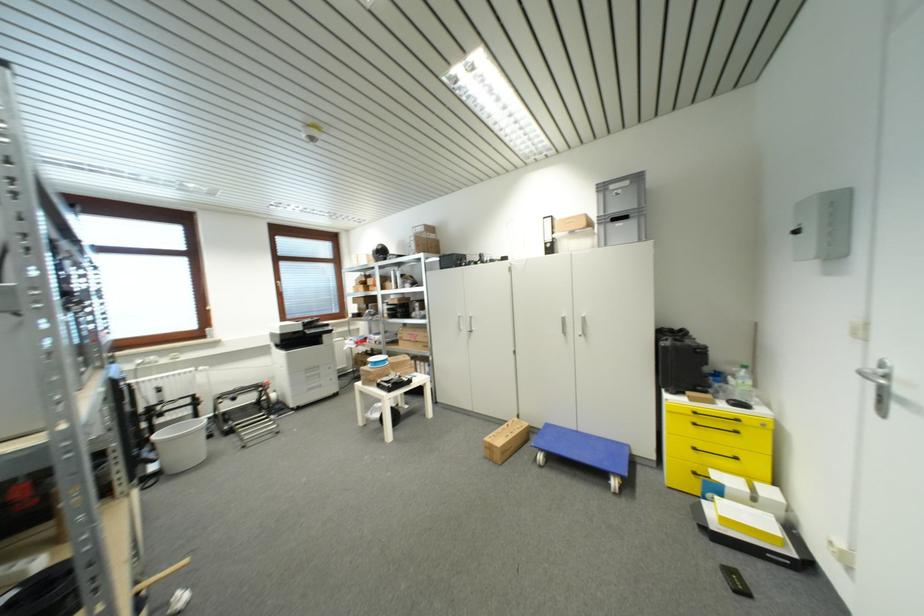
Identify the location of printer top cover. (298, 334).